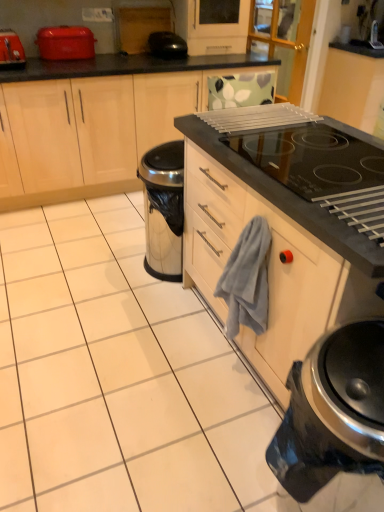
Question: From a real-world perspective, is matte red toaster at upper left, the 1th kitchen appliance in the left-to-right sequence, positioned above or below gray cotton hand towel at center?

Choices:
 (A) above
 (B) below

Answer: (A)

Question: Is matte red toaster at upper left, the second kitchen appliance from the front, inside the boundaries of gray cotton hand towel at center, or outside?

Choices:
 (A) outside
 (B) inside

Answer: (A)

Question: Estimate the real-world distances between objects in this image. Which object is closer to the black glossy toaster at upper center?

Choices:
 (A) matte red toaster at upper left, positioned as the 2th kitchen appliance in top-to-bottom order
 (B) matte red toaster at upper left, which is the 1th kitchen appliance in top-to-bottom order
 (C) matte wood cabinets at left
 (D) satin black kettle at lower right, the third kitchen appliance positioned from the left
 (E) black glass oven at upper right

Answer: (B)

Question: Which is nearer to the matte red toaster at upper left, marked as the 3th kitchen appliance in a bottom-to-top arrangement?

Choices:
 (A) gray cotton hand towel at center
 (B) black glossy toaster at upper center
 (C) black glass oven at upper right
 (D) matte wood cabinets at left
 (E) satin black kettle at lower right, the third kitchen appliance positioned from the left

Answer: (B)